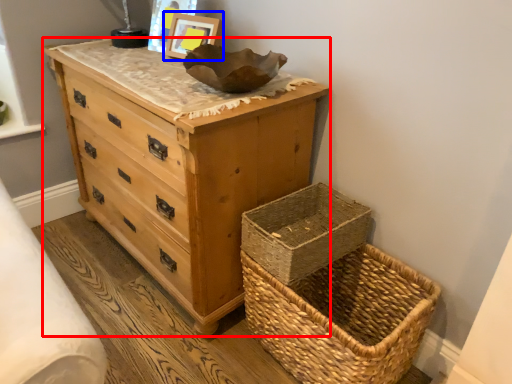
Question: Which object appears farthest to the camera in this image, chest of drawers (highlighted by a red box) or picture frame (highlighted by a blue box)?

Choices:
 (A) chest of drawers
 (B) picture frame

Answer: (B)